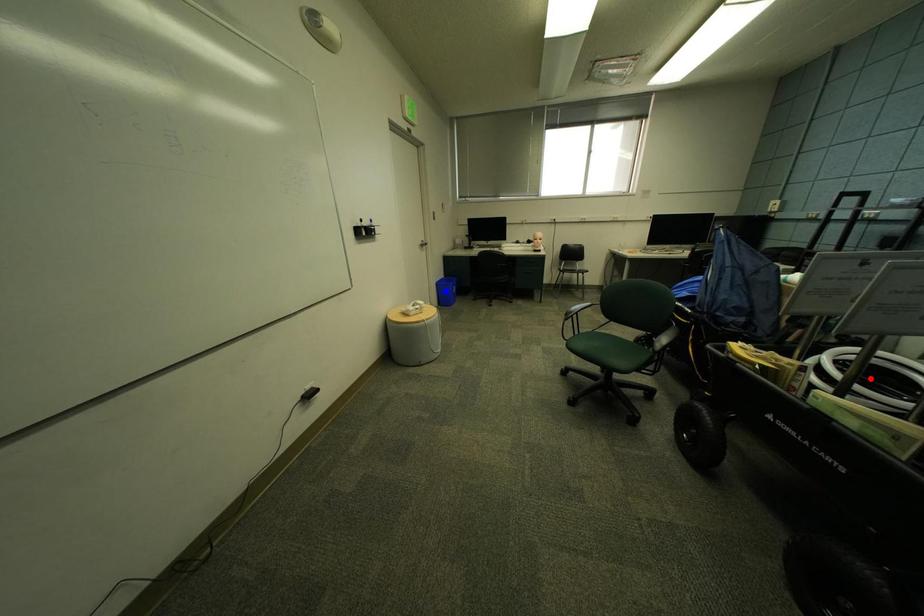
Question: Two points are marked on the image. Which point is closer to the camera?

Choices:
 (A) Blue point is closer.
 (B) Red point is closer.

Answer: (B)